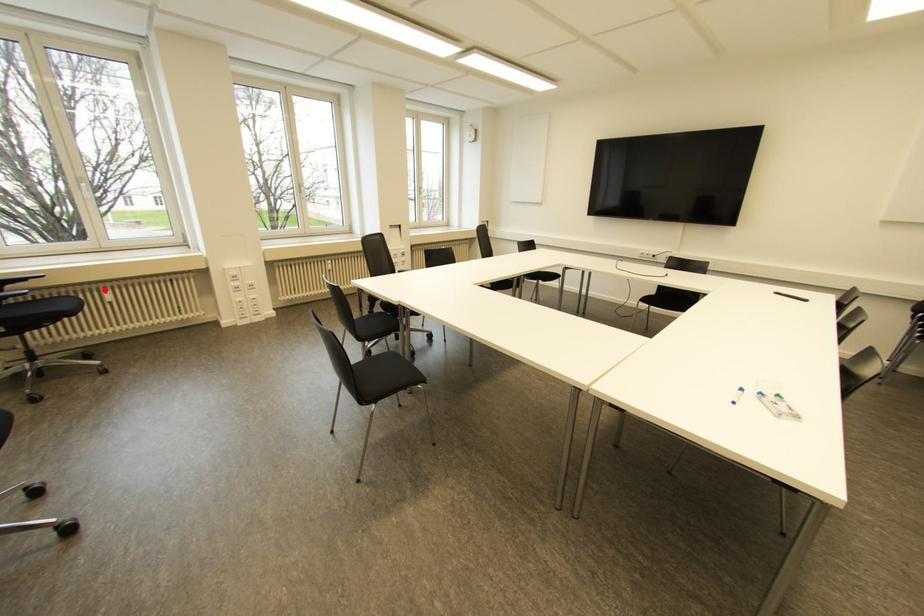
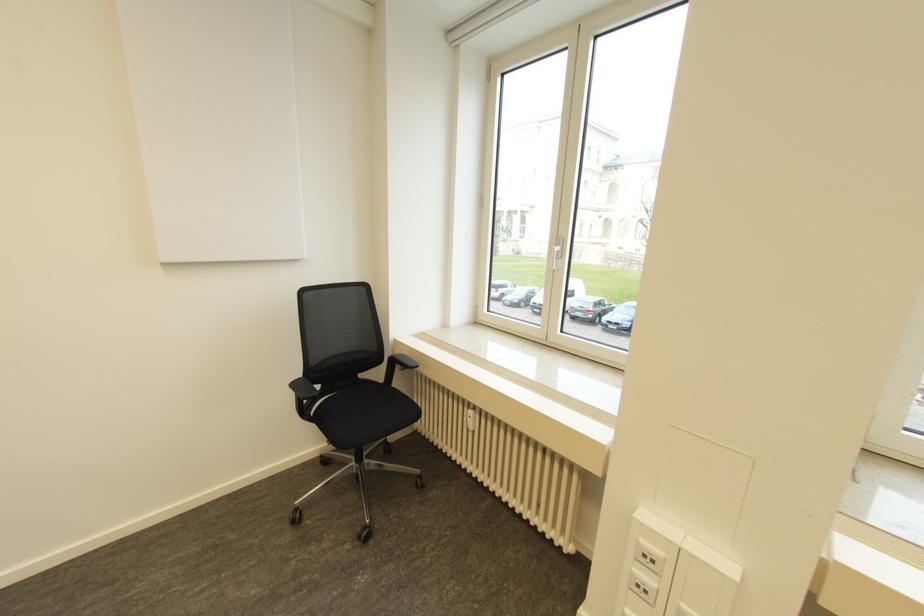
In the second image, find the point that corresponds to the highlighted location in the first image.

(469, 411)